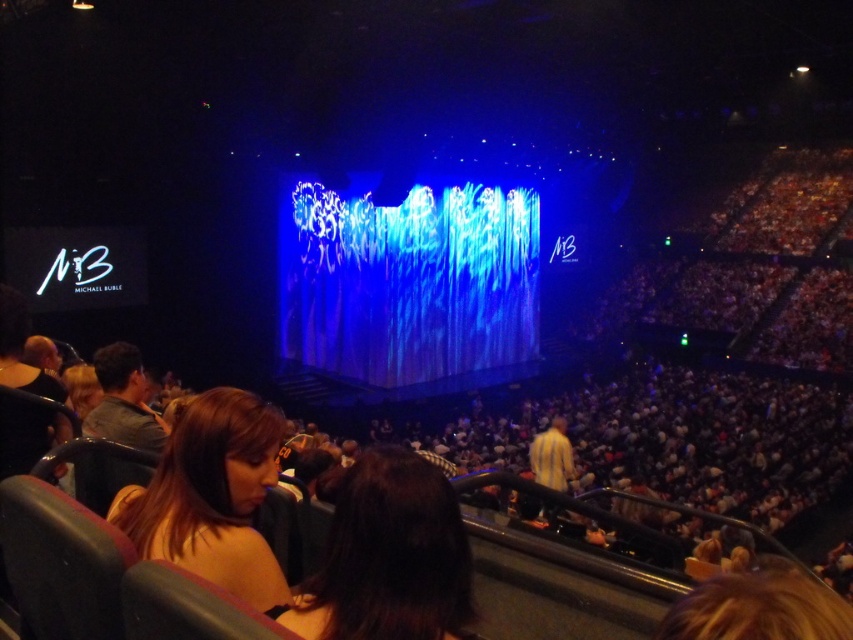
You are a stagehand carrying a 3.5 meter long ladder that needs to be placed between the brown hair at lower left and the gray fabric jacket at left. Can the ladder fit in the space between them?

The distance between the brown hair at lower left and the gray fabric jacket at left is 3.74 meters, so the ladder can fit since it is shorter than the available space.

You are standing at the point marked as point (x=387, y=557) in the image. What is the nearest object to you?

The nearest object to you is the brown hair at center, as the point (x=387, y=557) is located on it.

You are a photographer at the concert and want to capture a closeup of the brown hair at center. Your camera has a minimum focusing distance of 10 feet. Can you take the photo without moving closer?

The brown hair at center and the viewer are 11.38 feet apart. Since the minimum focusing distance is 10 feet, the photographer can take the photo without moving closer because the distance is within the camera range.